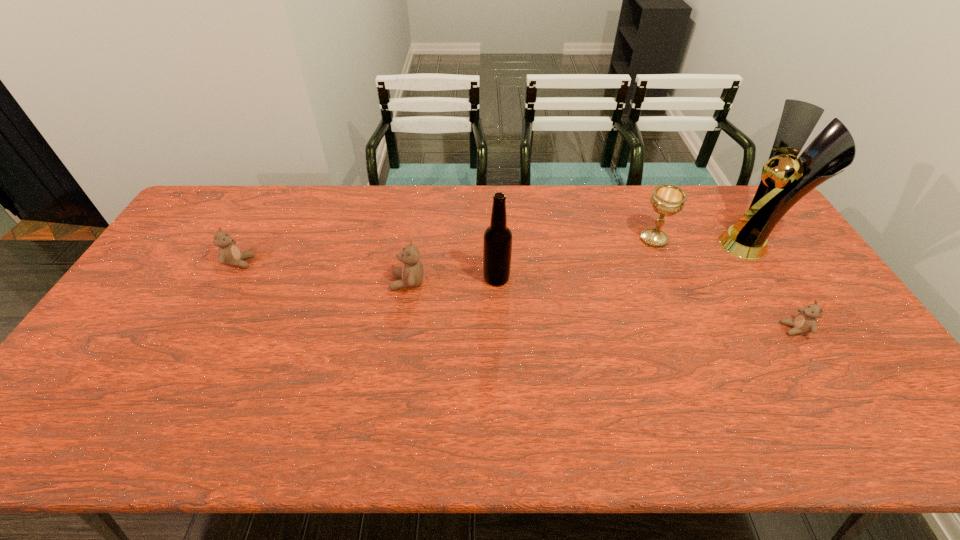
The image size is (960, 540). I want to click on the closest object to the second teddy bear from right to left, so click(497, 245).

Find the location of a particular element. This screenshot has width=960, height=540. object that is the fourth closest one to the third tallest object is located at coordinates (411, 274).

Choose which teddy bear is the third nearest neighbor to the tallest object. Please provide its 2D coordinates. Your answer should be formatted as a tuple, i.e. [(x, y)], where the tuple contains the x and y coordinates of a point satisfying the conditions above.

[(229, 254)]

Choose which teddy bear is the second nearest neighbor to the chalice. Please provide its 2D coordinates. Your answer should be formatted as a tuple, i.e. [(x, y)], where the tuple contains the x and y coordinates of a point satisfying the conditions above.

[(411, 274)]

At what (x,y) coordinates should I click in order to perform the action: click on vacant point that satisfies the following two spatial constraints: 1. on the front side of the beer bottle; 2. on the front-facing side of the fourth tallest object. Please return your answer as a coordinate pair (x, y). Looking at the image, I should click on (496, 282).

Where is `blank area in the image that satisfies the following two spatial constraints: 1. on the front-facing side of the fifth tallest object; 2. on the left side of the beer bottle`? blank area in the image that satisfies the following two spatial constraints: 1. on the front-facing side of the fifth tallest object; 2. on the left side of the beer bottle is located at coordinates (230, 278).

You are a GUI agent. You are given a task and a screenshot of the screen. Output one action in this format:
    pyautogui.click(x=<x>, y=<y>)
    Task: Click on the vacant space that satisfies the following two spatial constraints: 1. on the front side of the chalice; 2. on the front-facing side of the fifth tallest object
    This screenshot has height=540, width=960.
    Given the screenshot: What is the action you would take?
    pyautogui.click(x=663, y=262)